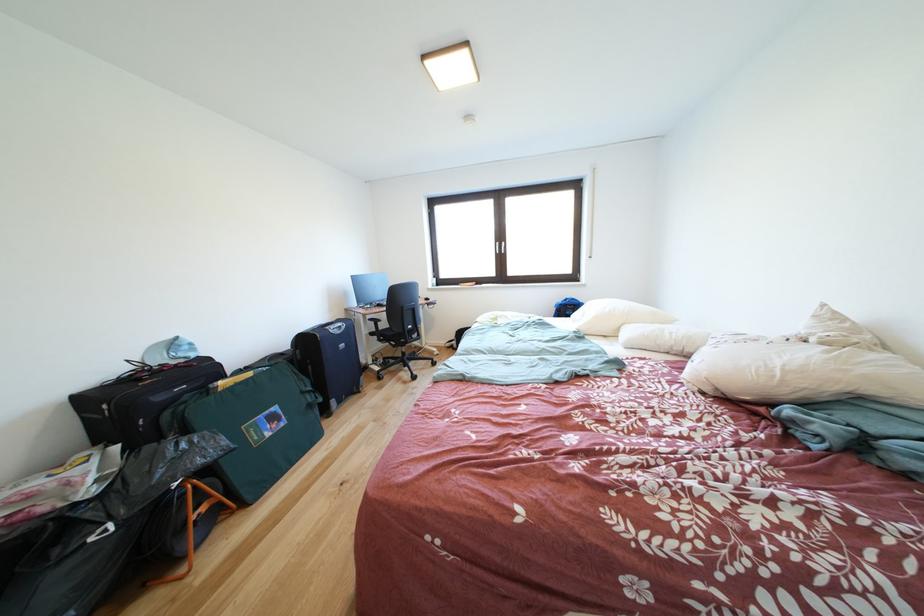
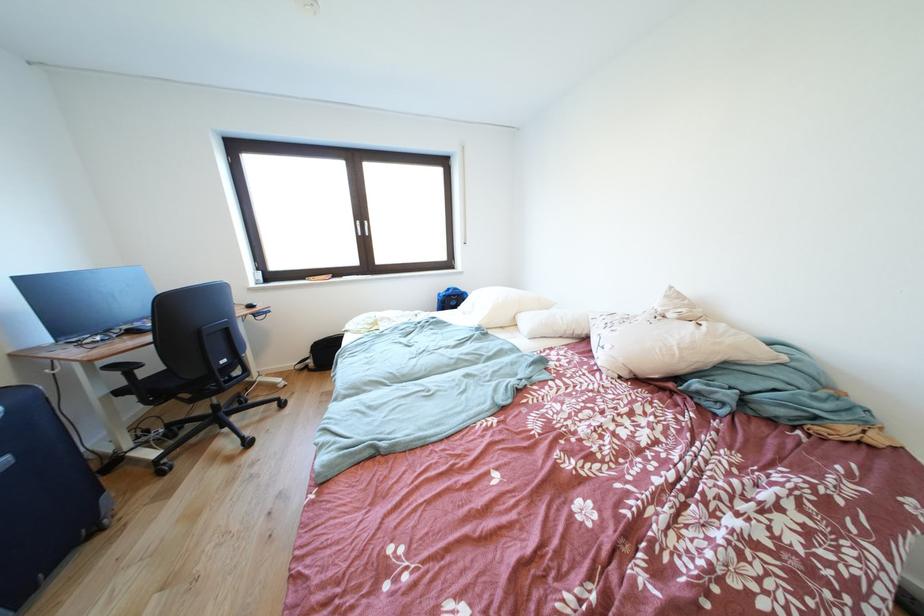
Question: The first image is from the beginning of the video and the second image is from the end. How did the camera likely rotate when shooting the video?

Choices:
 (A) Left
 (B) Right
 (C) Up
 (D) Down

Answer: (B)